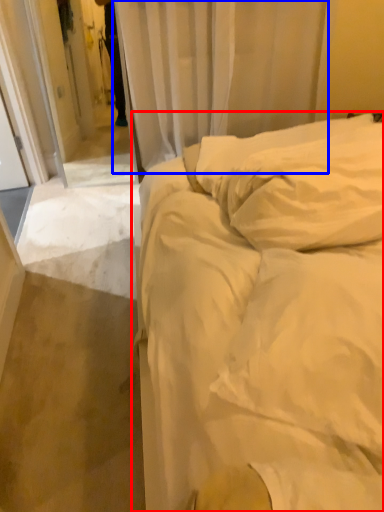
Question: Among these objects, which one is farthest to the camera, bed (highlighted by a red box) or curtain (highlighted by a blue box)?

Choices:
 (A) bed
 (B) curtain

Answer: (B)